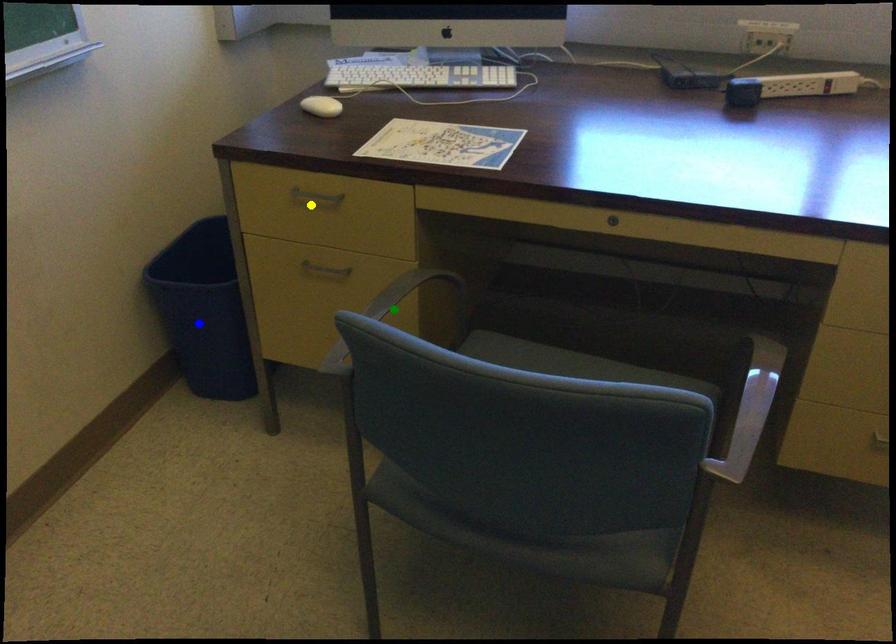
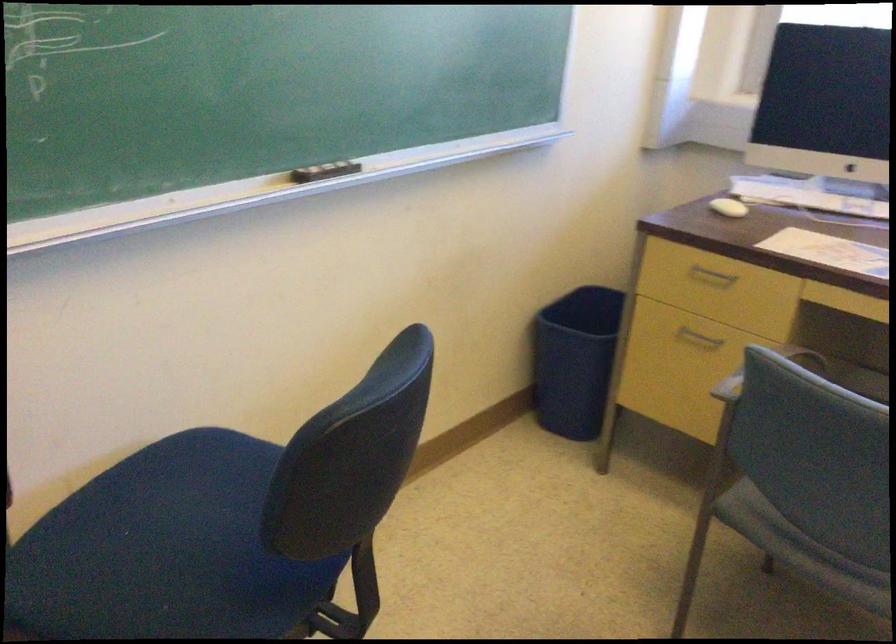
I am providing you with two images of the same scene from different viewpoints. Three points are marked in image1. Which point corresponds to a part or object that is occluded in image2?In image1, three points are marked. Which of them correspond to a part or object that is occluded in image2?Among the three points shown in image1, which one corresponds to a part or object that is no longer visible due to occlusion in image2?

green point cannot be seen in image2.